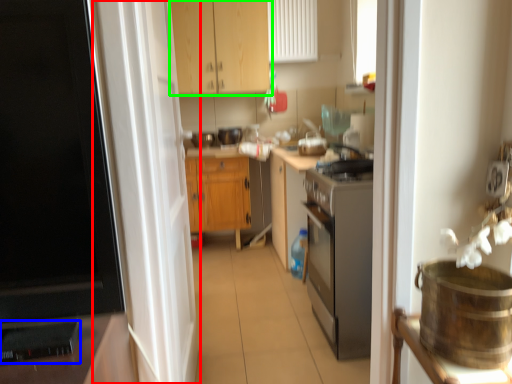
Question: Which object is the closest to the screen door (highlighted by a red box)? Choose among these: appliance (highlighted by a blue box) or cabinetry (highlighted by a green box).

Choices:
 (A) appliance
 (B) cabinetry

Answer: (A)